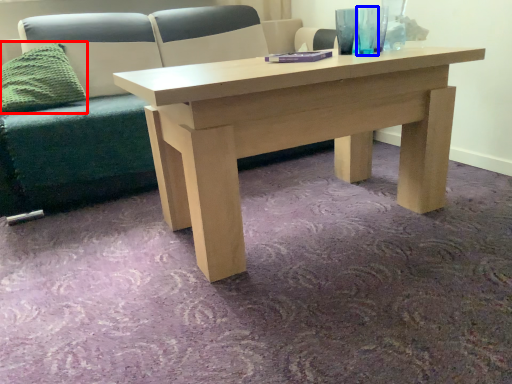
Question: Which object appears farthest to the camera in this image, pillow (highlighted by a red box) or glass vase (highlighted by a blue box)?

Choices:
 (A) pillow
 (B) glass vase

Answer: (A)